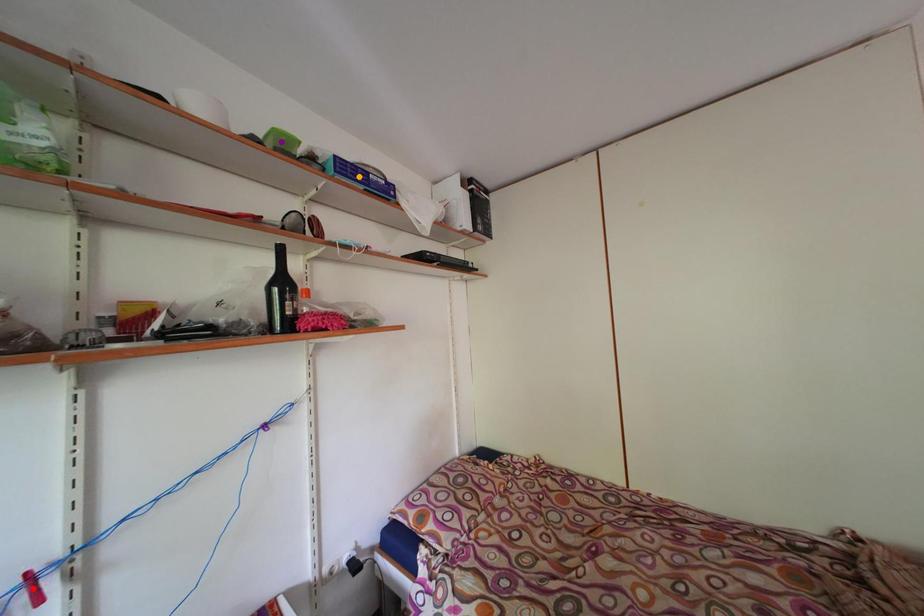
Order these from nearest to farthest:
- red point
- orange point
- purple point

red point
purple point
orange point